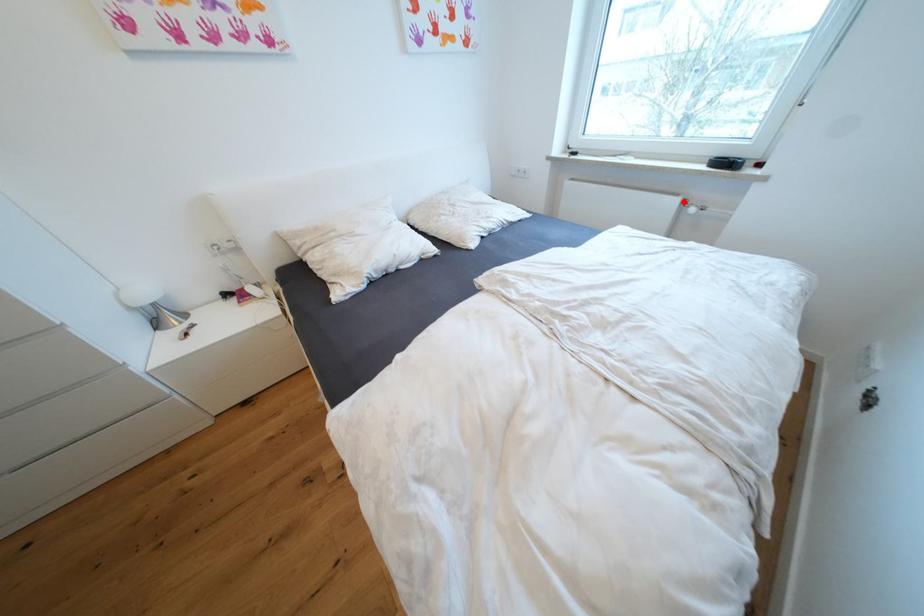
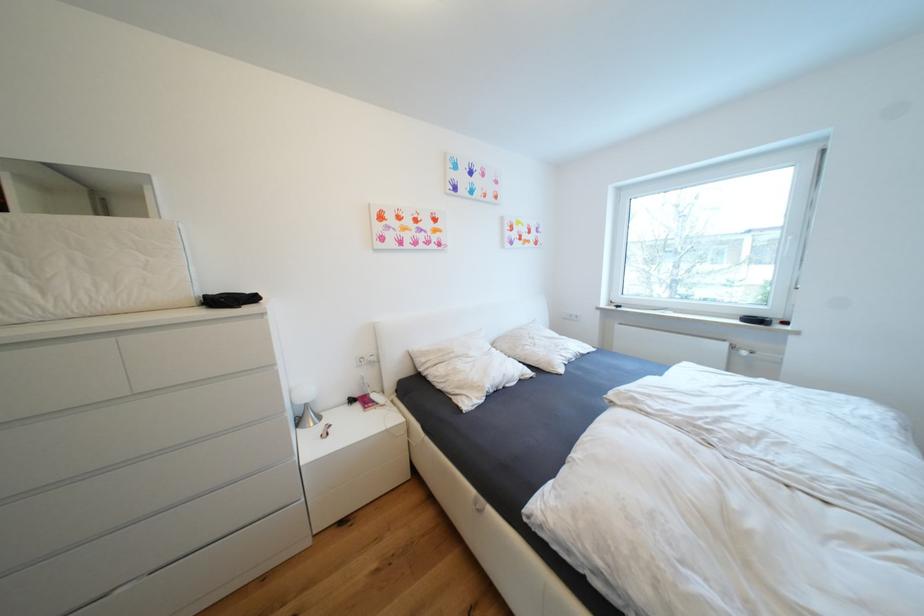
Where in the second image is the point corresponding to the highlighted location from the first image?

(733, 346)